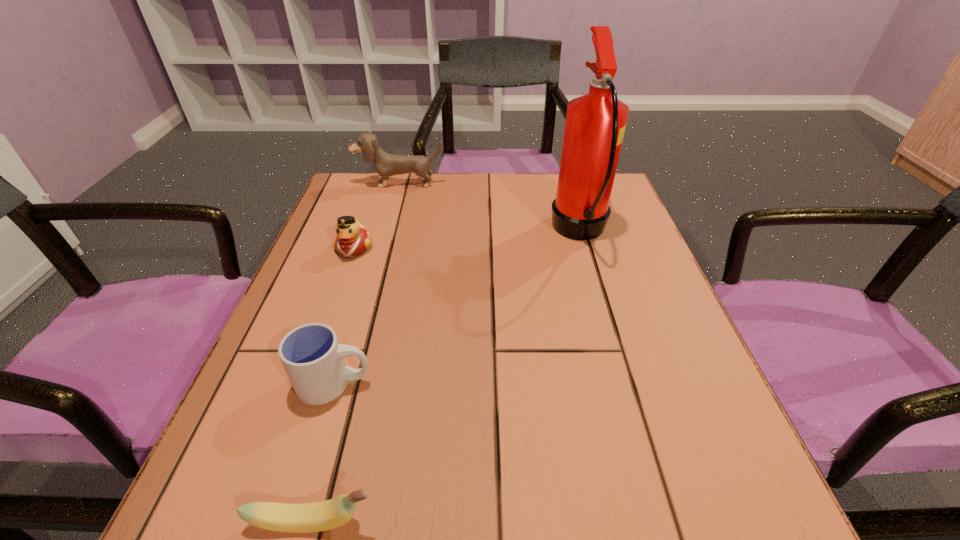
I want to click on free space located 0.050m at the face of the farthest object, so click(x=395, y=199).

Locate an element on the screen. This screenshot has height=540, width=960. vacant space located with the handle on the side of the second nearest object is located at coordinates (495, 384).

Image resolution: width=960 pixels, height=540 pixels. I want to click on vacant point located on the face of the duck, so click(327, 323).

You are a GUI agent. You are given a task and a screenshot of the screen. Output one action in this format:
    pyautogui.click(x=<x>, y=<y>)
    Task: Click on the free space located at the stem of the nearest object
    This screenshot has height=540, width=960.
    Given the screenshot: What is the action you would take?
    pyautogui.click(x=554, y=522)

At what (x,y) coordinates should I click in order to perform the action: click on fire extinguisher that is at the far edge. Please return your answer as a coordinate pair (x, y). This screenshot has height=540, width=960. Looking at the image, I should click on (595, 123).

This screenshot has width=960, height=540. Find the location of `puppy positioned at the far edge`. puppy positioned at the far edge is located at coordinates (385, 164).

You are a GUI agent. You are given a task and a screenshot of the screen. Output one action in this format:
    pyautogui.click(x=<x>, y=<y>)
    Task: Click on the object that is at the near edge
    
    Given the screenshot: What is the action you would take?
    pyautogui.click(x=318, y=516)

Locate an element on the screen. puppy present at the left edge is located at coordinates (385, 164).

What are the coordinates of `cup that is at the left edge` in the screenshot? It's located at click(x=313, y=359).

The image size is (960, 540). In order to click on duck that is at the left edge in this screenshot , I will do `click(352, 239)`.